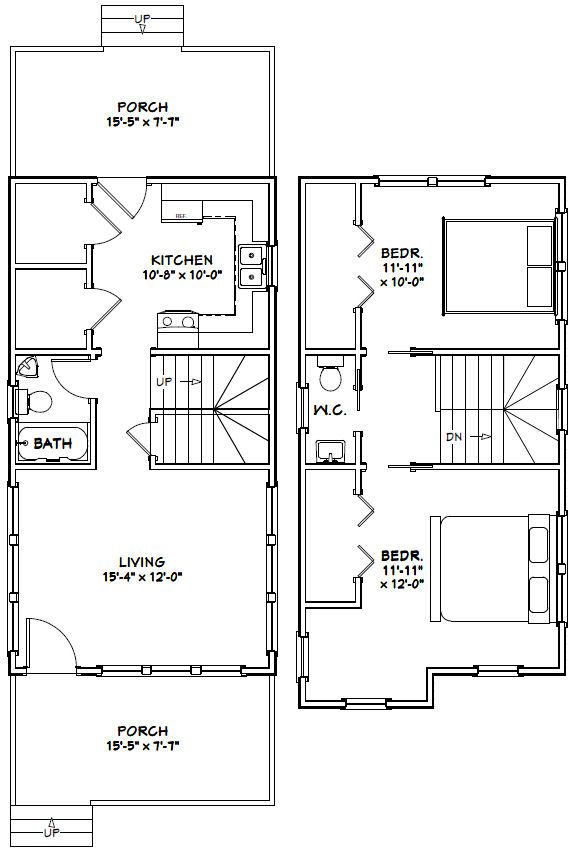
Find the location of `rooms`. rooms is located at coordinates (x=176, y=614), (x=387, y=640), (x=404, y=300), (x=133, y=251), (x=46, y=402), (x=338, y=407).